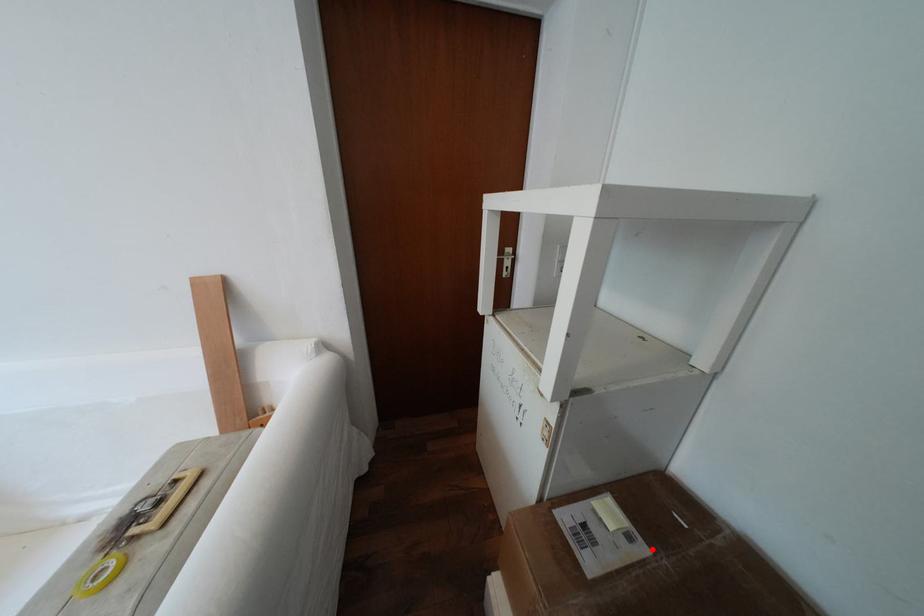
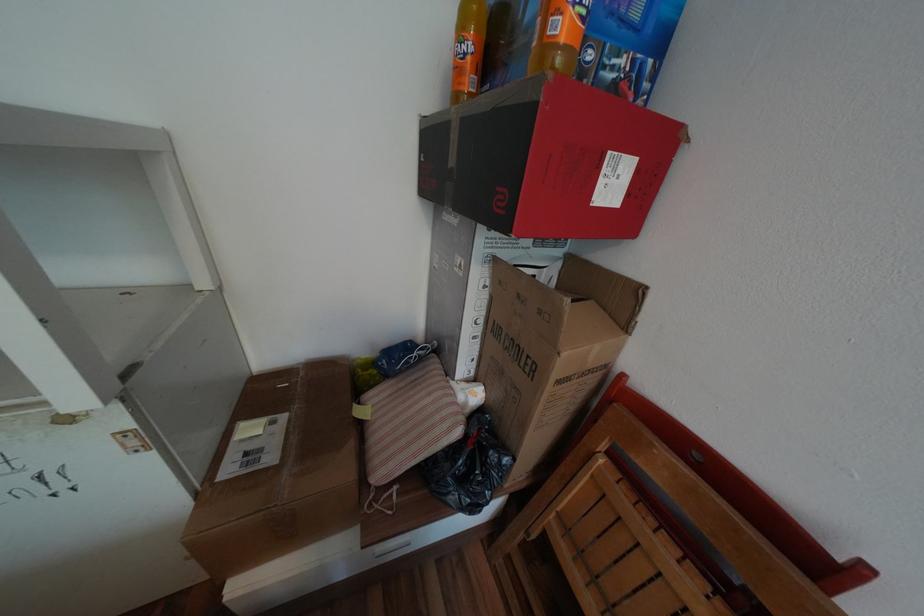
The point at the highlighted location is marked in the first image. Where is the corresponding point in the second image?

(293, 416)